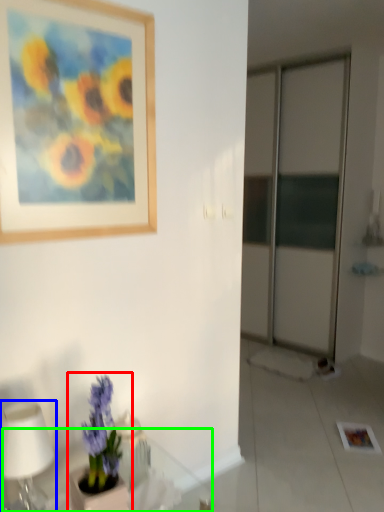
Question: Which object is positioned closest to houseplant (highlighted by a red box)? Select from table lamp (highlighted by a blue box) and round table (highlighted by a green box).

Choices:
 (A) table lamp
 (B) round table

Answer: (A)